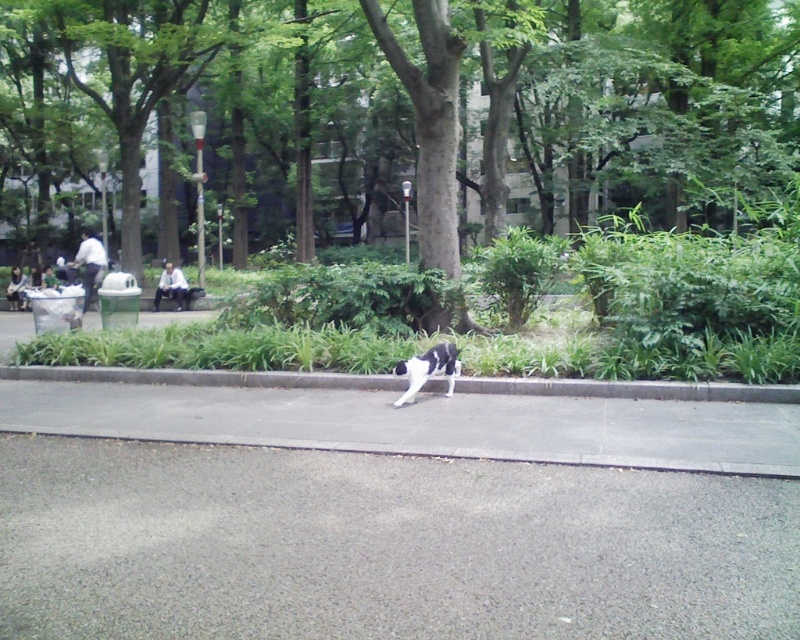
Question: Which point is farther from the camera taking this photo?

Choices:
 (A) (61, 380)
 (B) (182, 493)
 (C) (350, 134)

Answer: (C)

Question: Does gray asphalt pavement at lower center have a larger size compared to black-and-white fur cat at center?

Choices:
 (A) yes
 (B) no

Answer: (A)

Question: Among these points, which one is farthest from the camera?

Choices:
 (A) (484, 628)
 (B) (428, 360)
 (C) (430, 385)

Answer: (C)

Question: Which object is positioned closest to the green leafy tree at center?

Choices:
 (A) black-and-white fur cat at center
 (B) gray concrete curb at lower center

Answer: (A)

Question: From the image, what is the correct spatial relationship of gray asphalt pavement at lower center in relation to gray concrete curb at lower center?

Choices:
 (A) right
 (B) left

Answer: (A)

Question: Is the position of gray asphalt pavement at lower center more distant than that of gray concrete curb at lower center?

Choices:
 (A) no
 (B) yes

Answer: (A)